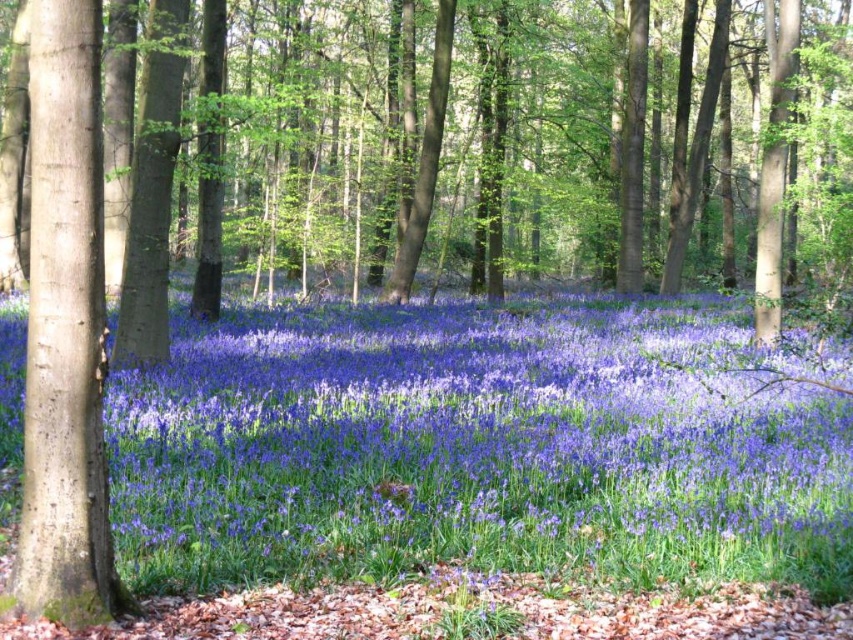
Question: Does purple matte flower at center have a lesser width compared to smooth brown tree trunk at left?

Choices:
 (A) no
 (B) yes

Answer: (A)

Question: Does purple matte flower at center have a smaller size compared to smooth brown tree trunk at left?

Choices:
 (A) yes
 (B) no

Answer: (B)

Question: Is purple matte flower at center closer to the viewer compared to smooth brown tree trunk at left?

Choices:
 (A) no
 (B) yes

Answer: (A)